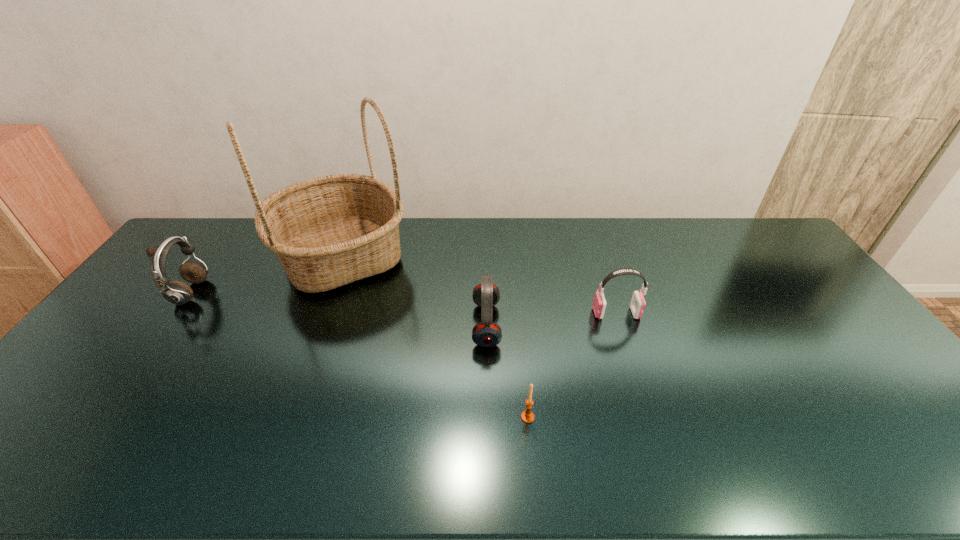
Locate an element on the screen. The image size is (960, 540). vacant space located on the outer surface of the rightmost object is located at coordinates (495, 313).

This screenshot has width=960, height=540. I want to click on vacant space situated 0.380m on the outer surface of the rightmost object, so click(468, 313).

At what (x,y) coordinates should I click in order to perform the action: click on vacant region located 0.320m on the outer surface of the rightmost object. Please return your answer as a coordinate pair (x, y). This screenshot has height=540, width=960. Looking at the image, I should click on (489, 313).

Where is `vacant area situated on the ear cups of the third object from right to left`? The width and height of the screenshot is (960, 540). vacant area situated on the ear cups of the third object from right to left is located at coordinates click(358, 325).

At what (x,y) coordinates should I click in order to perform the action: click on vacant region located 0.160m on the ear cups of the third object from right to left. Please return your answer as a coordinate pair (x, y). The image size is (960, 540). Looking at the image, I should click on (419, 325).

Locate an element on the screen. vacant region located on the ear cups of the third object from right to left is located at coordinates (405, 325).

Where is `free space located on the left of the shortest object`? free space located on the left of the shortest object is located at coordinates (386, 417).

The image size is (960, 540). Identify the location of object located at the far edge. (329, 231).

Where is `object present at the left edge`? This screenshot has width=960, height=540. object present at the left edge is located at coordinates (176, 292).

The image size is (960, 540). I want to click on vacant space at the far edge of the desktop, so click(x=685, y=226).